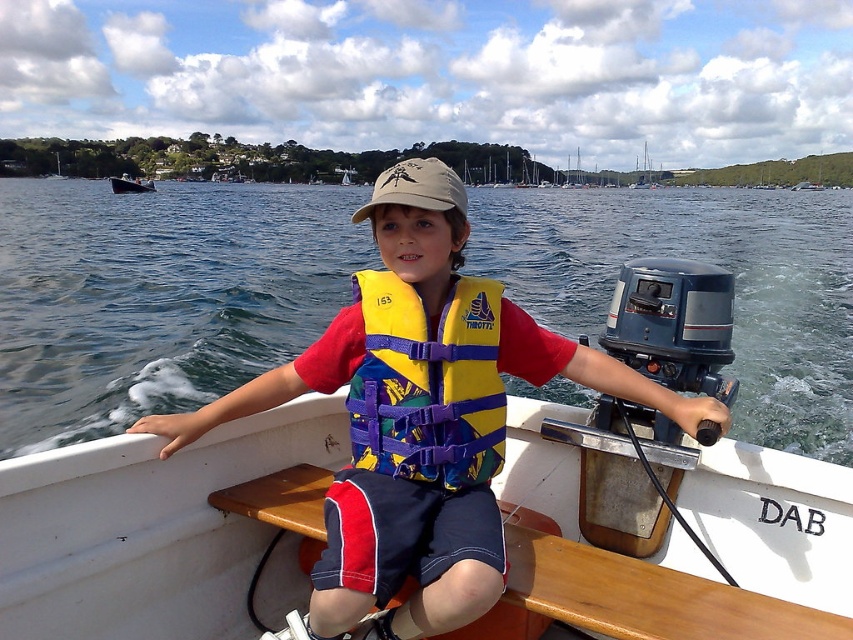
You are a safety inspector checking the distance between the blue water at center and the yellow fabric life vest at center on the motorboat. According to safety regulations, the maximum allowed distance between these two must be 50 feet to ensure quick access to the life vest. Is the current distance compliant?

The blue water at center is 46.71 feet away from the yellow fabric life vest at center, which is within the 50 feet maximum requirement, so it is compliant.